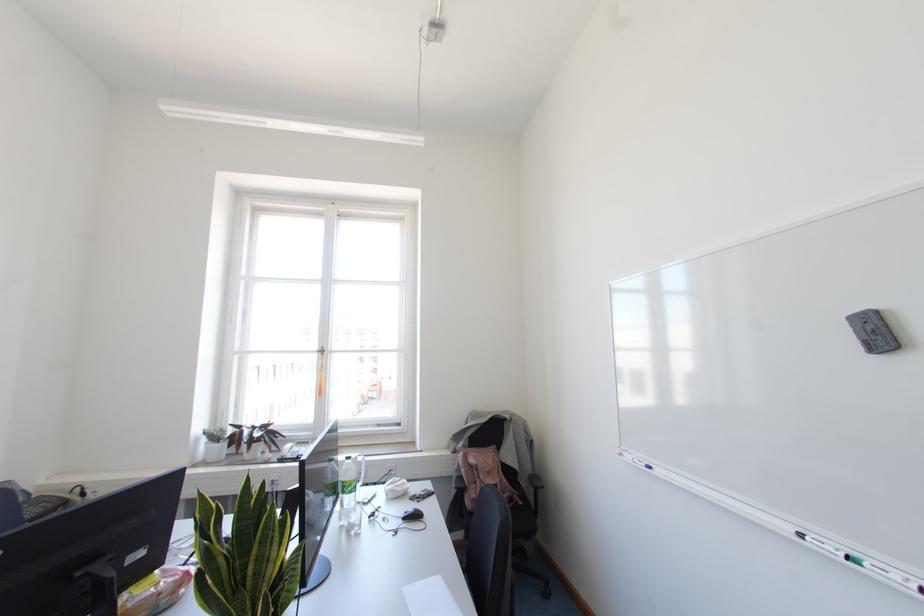
This screenshot has width=924, height=616. In order to click on green plastic bottle in this screenshot , I will do `click(347, 485)`.